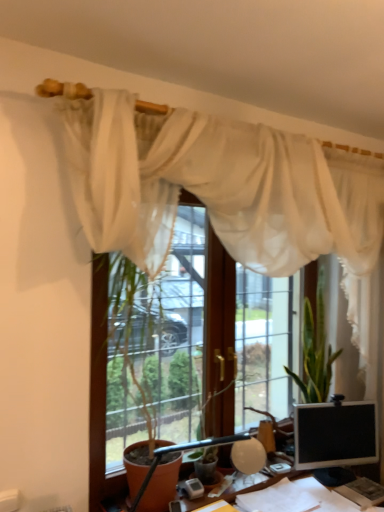
Question: Considering the relative positions of sheer white curtain at upper center and matte black monitor at lower right in the image provided, is sheer white curtain at upper center behind matte black monitor at lower right?

Choices:
 (A) no
 (B) yes

Answer: (A)

Question: Is the depth of sheer white curtain at upper center less than that of matte black monitor at lower right?

Choices:
 (A) yes
 (B) no

Answer: (A)

Question: Is sheer white curtain at upper center facing towards matte black monitor at lower right?

Choices:
 (A) no
 (B) yes

Answer: (B)

Question: Is sheer white curtain at upper center smaller than matte black monitor at lower right?

Choices:
 (A) no
 (B) yes

Answer: (A)

Question: Is matte black monitor at lower right inside sheer white curtain at upper center?

Choices:
 (A) yes
 (B) no

Answer: (A)

Question: From a real-world perspective, is matte black monitor at lower right positioned above or below transparent glass window at center?

Choices:
 (A) below
 (B) above

Answer: (A)

Question: Considering the positions of matte black monitor at lower right and transparent glass window at center in the image, is matte black monitor at lower right bigger or smaller than transparent glass window at center?

Choices:
 (A) small
 (B) big

Answer: (A)

Question: Is matte black monitor at lower right in front of or behind transparent glass window at center in the image?

Choices:
 (A) front
 (B) behind

Answer: (B)

Question: Is matte black monitor at lower right situated inside transparent glass window at center or outside?

Choices:
 (A) inside
 (B) outside

Answer: (B)

Question: Is point (253, 457) positioned closer to the camera than point (99, 481)?

Choices:
 (A) closer
 (B) farther

Answer: (B)

Question: Based on their positions, is matte black table lamp at center located to the left or right of transparent glass window at center?

Choices:
 (A) left
 (B) right

Answer: (B)

Question: Is matte black table lamp at center in front of or behind transparent glass window at center in the image?

Choices:
 (A) front
 (B) behind

Answer: (A)

Question: Is matte black table lamp at center taller or shorter than transparent glass window at center?

Choices:
 (A) tall
 (B) short

Answer: (B)

Question: Which is correct: green leafy plant at center is inside matte black monitor at lower right, or outside of it?

Choices:
 (A) inside
 (B) outside

Answer: (B)

Question: From their relative heights in the image, would you say green leafy plant at center is taller or shorter than matte black monitor at lower right?

Choices:
 (A) short
 (B) tall

Answer: (B)